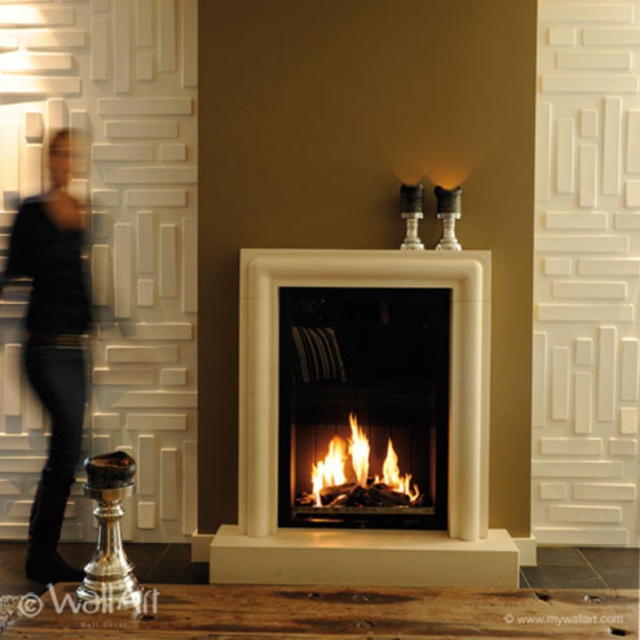
Question: Which object appears closest to the camera in this image?

Choices:
 (A) white marble fireplace at center
 (B) orange flame wood at center
 (C) black matte shirt at left

Answer: (C)

Question: Among these objects, which one is nearest to the camera?

Choices:
 (A) orange flame wood at center
 (B) black matte shirt at left

Answer: (B)

Question: Does black matte shirt at left come in front of orange flame wood at center?

Choices:
 (A) no
 (B) yes

Answer: (B)

Question: Can you confirm if white marble fireplace at center is positioned to the left of black matte shirt at left?

Choices:
 (A) yes
 (B) no

Answer: (B)

Question: Which of the following is the farthest from the observer?

Choices:
 (A) (394, 483)
 (B) (472, 461)

Answer: (A)

Question: Can you confirm if white marble fireplace at center is wider than black matte shirt at left?

Choices:
 (A) yes
 (B) no

Answer: (A)